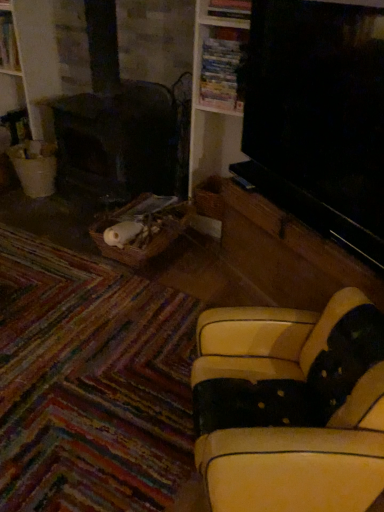
Question: Is wooden bookshelf at upper center facing away from leather-like yellow couch at lower right?

Choices:
 (A) yes
 (B) no

Answer: (B)

Question: Is wooden bookshelf at upper center wider than leather-like yellow couch at lower right?

Choices:
 (A) yes
 (B) no

Answer: (B)

Question: From the image's perspective, would you say wooden bookshelf at upper center is shown under leather-like yellow couch at lower right?

Choices:
 (A) yes
 (B) no

Answer: (B)

Question: From a real-world perspective, is wooden bookshelf at upper center below leather-like yellow couch at lower right?

Choices:
 (A) no
 (B) yes

Answer: (A)

Question: Is wooden bookshelf at upper center next to leather-like yellow couch at lower right?

Choices:
 (A) no
 (B) yes

Answer: (A)

Question: Do you think leather-like yellow couch at lower right is within white painted wood bookshelf at upper left, or outside of it?

Choices:
 (A) inside
 (B) outside

Answer: (B)

Question: Is leather-like yellow couch at lower right to the left or to the right of white painted wood bookshelf at upper left in the image?

Choices:
 (A) left
 (B) right

Answer: (B)

Question: Considering their positions, is leather-like yellow couch at lower right located in front of or behind white painted wood bookshelf at upper left?

Choices:
 (A) front
 (B) behind

Answer: (A)

Question: Based on their sizes in the image, would you say leather-like yellow couch at lower right is bigger or smaller than white painted wood bookshelf at upper left?

Choices:
 (A) big
 (B) small

Answer: (A)

Question: Based on their positions, is white painted wood bookshelf at upper left located to the left or right of leather-like yellow couch at lower right?

Choices:
 (A) left
 (B) right

Answer: (A)

Question: In the image, is white painted wood bookshelf at upper left positioned in front of or behind leather-like yellow couch at lower right?

Choices:
 (A) behind
 (B) front

Answer: (A)

Question: From the image's perspective, is white painted wood bookshelf at upper left positioned above or below leather-like yellow couch at lower right?

Choices:
 (A) below
 (B) above

Answer: (B)

Question: Considering the positions of white painted wood bookshelf at upper left and leather-like yellow couch at lower right in the image, is white painted wood bookshelf at upper left taller or shorter than leather-like yellow couch at lower right?

Choices:
 (A) tall
 (B) short

Answer: (A)

Question: Relative to wooden bookshelf at upper center, is leather-like yellow couch at lower right in front or behind?

Choices:
 (A) behind
 (B) front

Answer: (B)

Question: From the image's perspective, is leather-like yellow couch at lower right located above or below wooden bookshelf at upper center?

Choices:
 (A) below
 (B) above

Answer: (A)